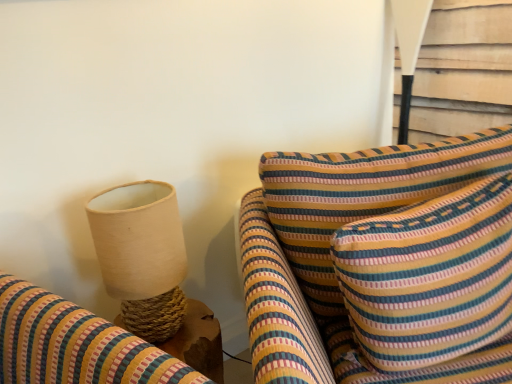
Question: From the image's perspective, is striped fabric cushion at center above or below natural woven lampshade at left, acting as the first table lamp starting from the front?

Choices:
 (A) above
 (B) below

Answer: (B)

Question: Considering the positions of striped fabric cushion at center and natural woven lampshade at left, the 1th table lamp positioned from the left, in the image, is striped fabric cushion at center taller or shorter than natural woven lampshade at left, the 1th table lamp positioned from the left,?

Choices:
 (A) short
 (B) tall

Answer: (B)

Question: Which of these objects is positioned closest to the natural woven lampshade at left, the second table lamp when ordered from right to left?

Choices:
 (A) striped fabric cushion at center
 (B) white fabric lampshade at upper right, the second table lamp positioned from the bottom

Answer: (A)

Question: Based on their relative distances, which object is nearer to the natural woven lampshade at left, arranged as the second table lamp when viewed from the top?

Choices:
 (A) white fabric lampshade at upper right, which appears as the first table lamp when viewed from the back
 (B) striped fabric cushion at center

Answer: (B)